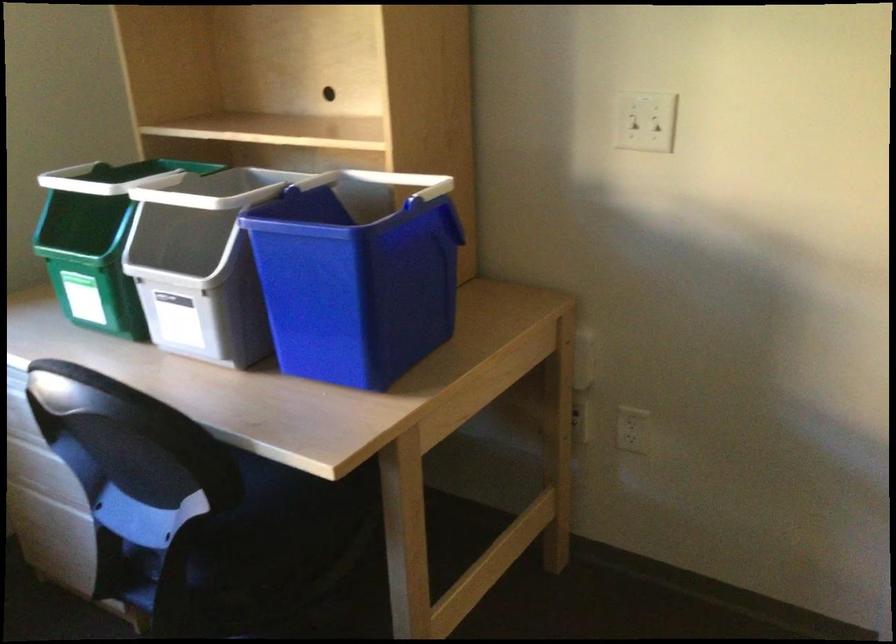
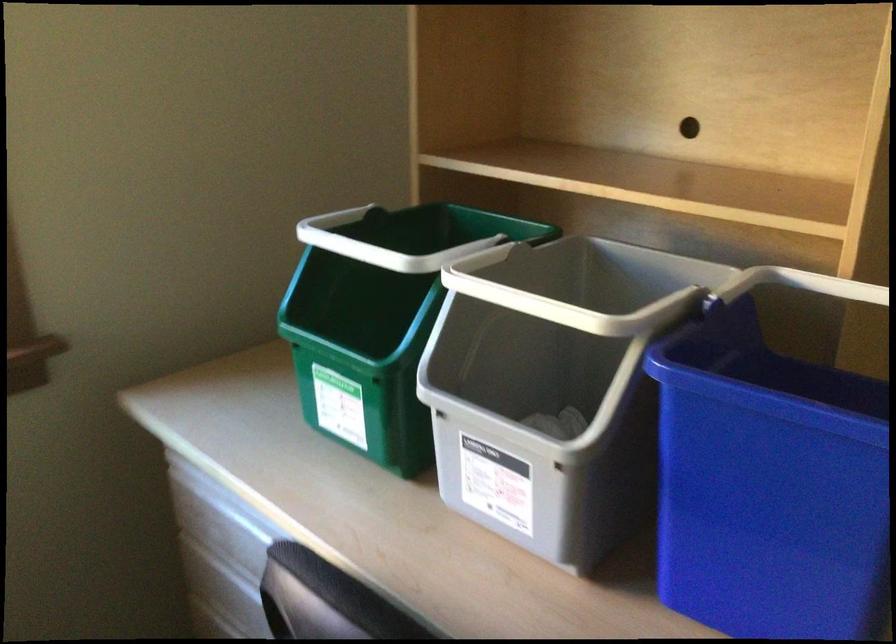
The images are taken continuously from a first-person perspective. In which direction are you moving?

The cameraman walked toward left, forward.